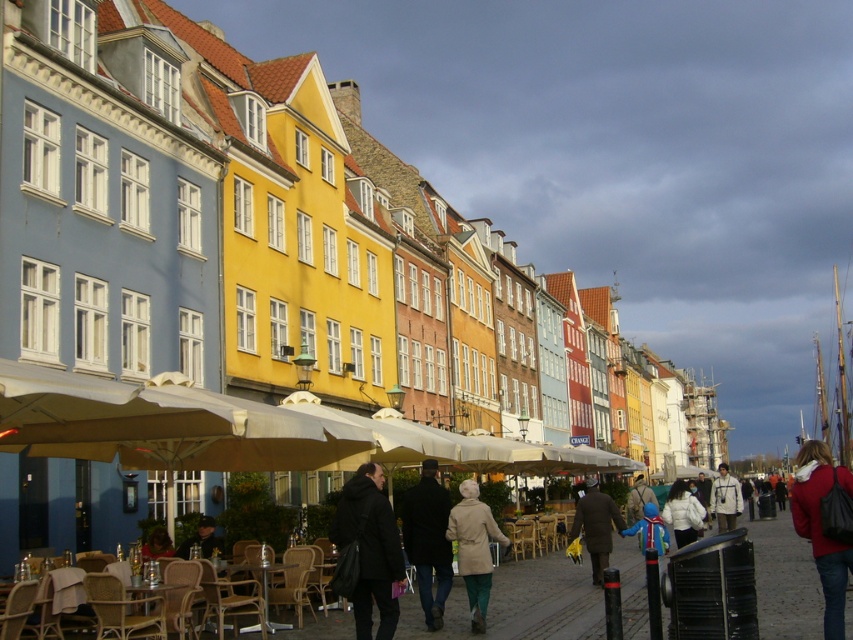
You are standing at the entrance of the street and want to find the matte yellow building at center. According to the coordinates provided, in which direction should you look to locate it?

The matte yellow building at center is located at coordinates point [276,243], which means it is positioned to the lower left from your current position at the entrance. You should look towards the lower left direction to find it.